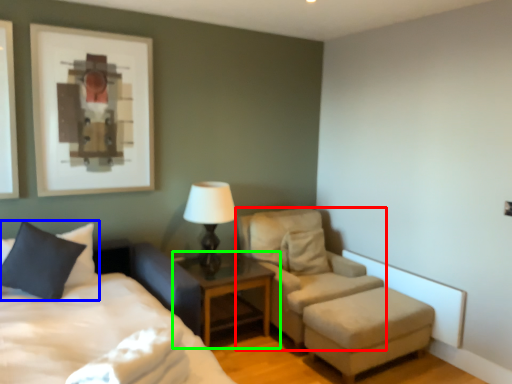
Question: Which is nearer to the chair (highlighted by a red box)? pillow (highlighted by a blue box) or nightstand (highlighted by a green box).

Choices:
 (A) pillow
 (B) nightstand

Answer: (B)